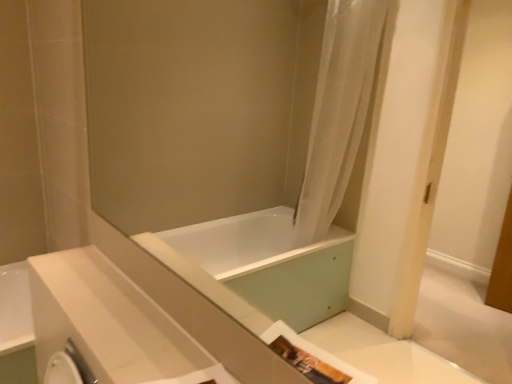
Find the location of a particular element. The width and height of the screenshot is (512, 384). white glossy drawer at lower left is located at coordinates (111, 323).

What do you see at coordinates (111, 323) in the screenshot?
I see `white glossy drawer at lower left` at bounding box center [111, 323].

The width and height of the screenshot is (512, 384). I want to click on white glossy drawer at lower left, so click(x=111, y=323).